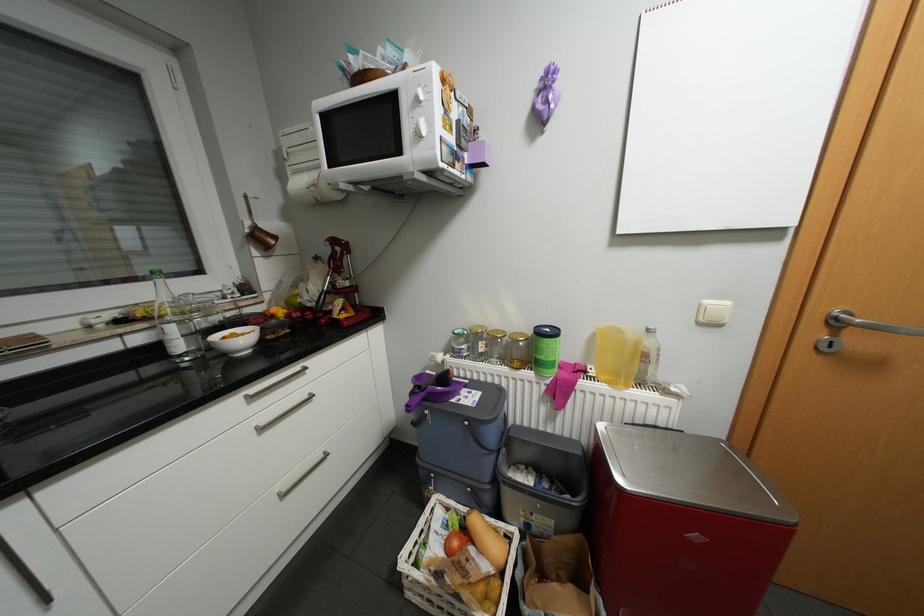
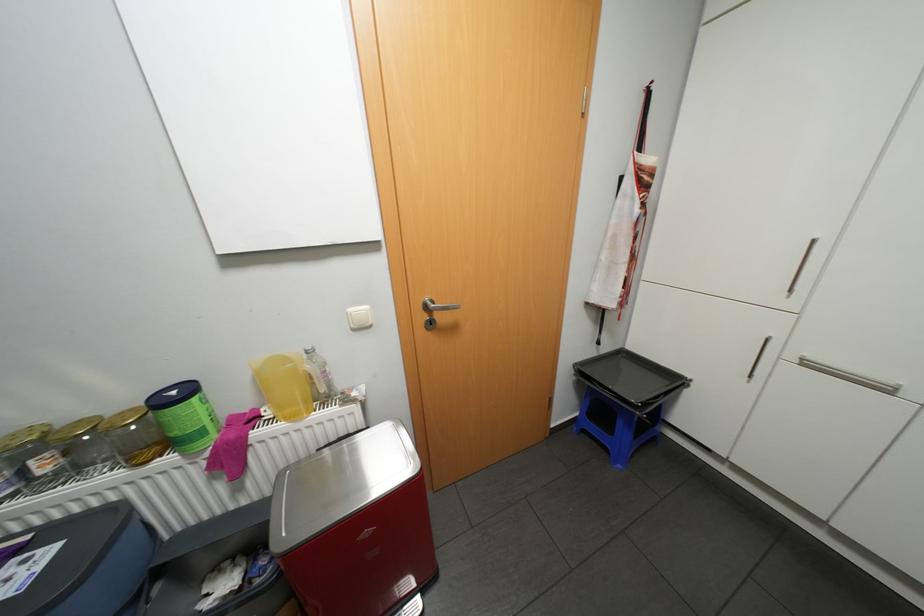
The point at (488, 342) is marked in the first image. Where is the corresponding point in the second image?

(39, 461)